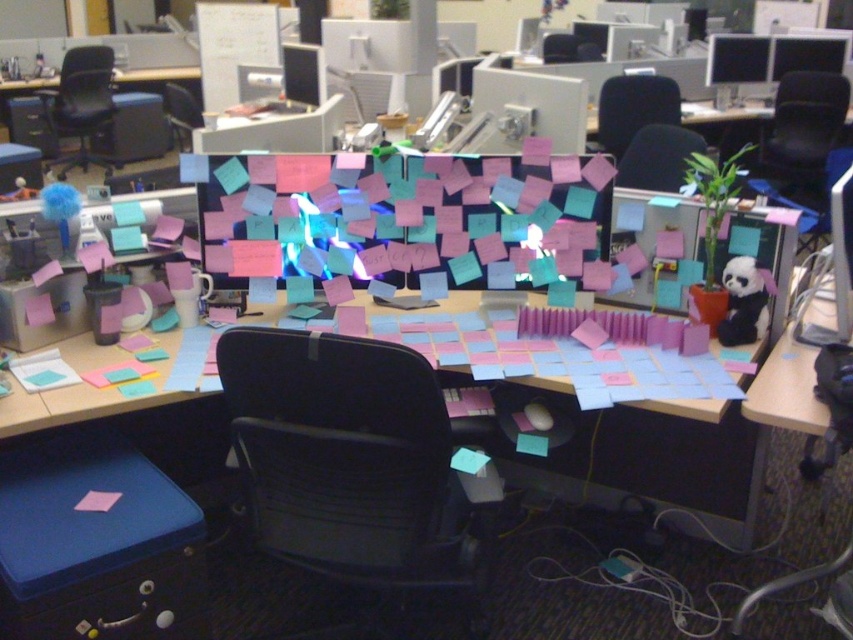
Question: Which point is closer to the camera?

Choices:
 (A) [x=810, y=144]
 (B) [x=70, y=352]
 (C) [x=177, y=90]

Answer: (B)

Question: Does black plastic chair at upper center lie in front of black plastic chair at upper left?

Choices:
 (A) no
 (B) yes

Answer: (B)

Question: Which is nearer to the black fabric chair at upper center?

Choices:
 (A) pink matte paper at center
 (B) black mesh swivel chair at center
 (C) black mesh office chair at upper left

Answer: (A)

Question: Which is nearer to the blue plastic desk at center?

Choices:
 (A) black fabric chair at upper center
 (B) black mesh office chair at upper left

Answer: (A)

Question: Is black fabric chair at upper right wider than black mesh office chair at upper left?

Choices:
 (A) yes
 (B) no

Answer: (B)

Question: Is black fabric chair at upper right behind black fabric chair at upper center?

Choices:
 (A) no
 (B) yes

Answer: (B)